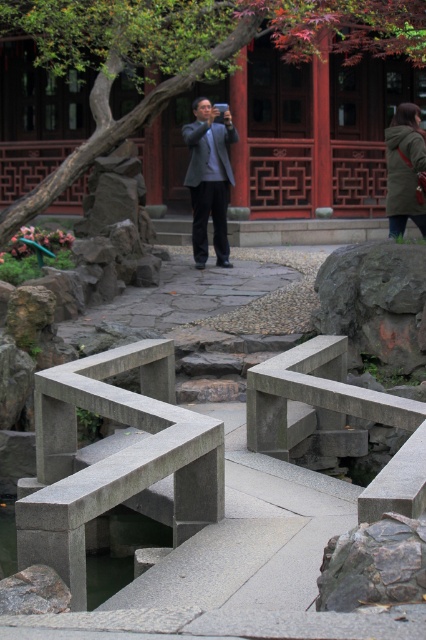
Question: Which point appears farthest from the camera in this image?

Choices:
 (A) (423, 172)
 (B) (206, 131)

Answer: (B)

Question: From the image, what is the correct spatial relationship of matte gray suit at center in relation to smooth gray stone pond at center?

Choices:
 (A) left
 (B) right

Answer: (B)

Question: Does gray stone bench at center lie behind dark green textured coat at center?

Choices:
 (A) yes
 (B) no

Answer: (B)

Question: In this image, where is green leafy tree at upper center located relative to gray stone bench at center?

Choices:
 (A) above
 (B) below

Answer: (A)

Question: Which point is farther from the camera taking this photo?

Choices:
 (A) (227, 173)
 (B) (114, 396)

Answer: (A)

Question: Which object appears farthest from the camera in this image?

Choices:
 (A) matte gray suit at center
 (B) smooth gray stone pond at center

Answer: (A)